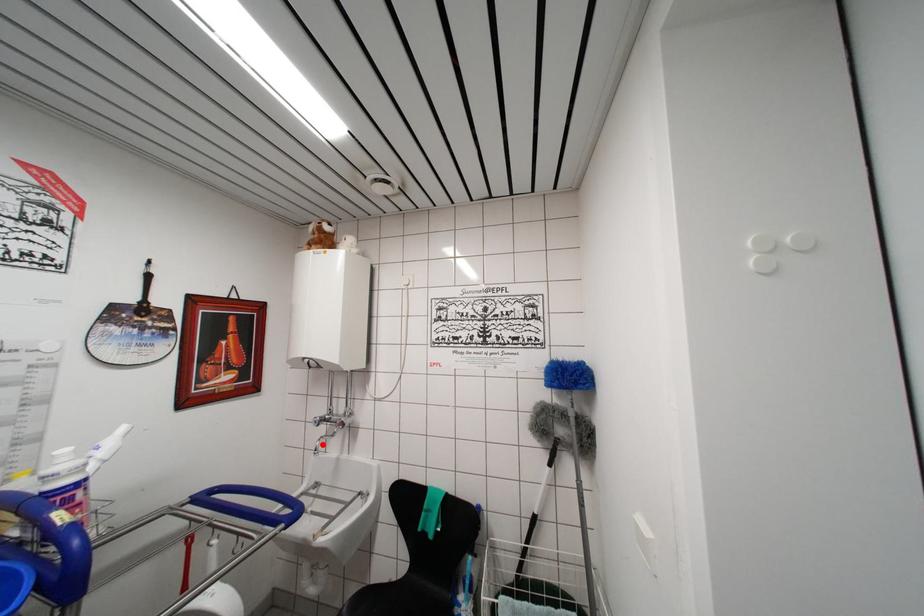
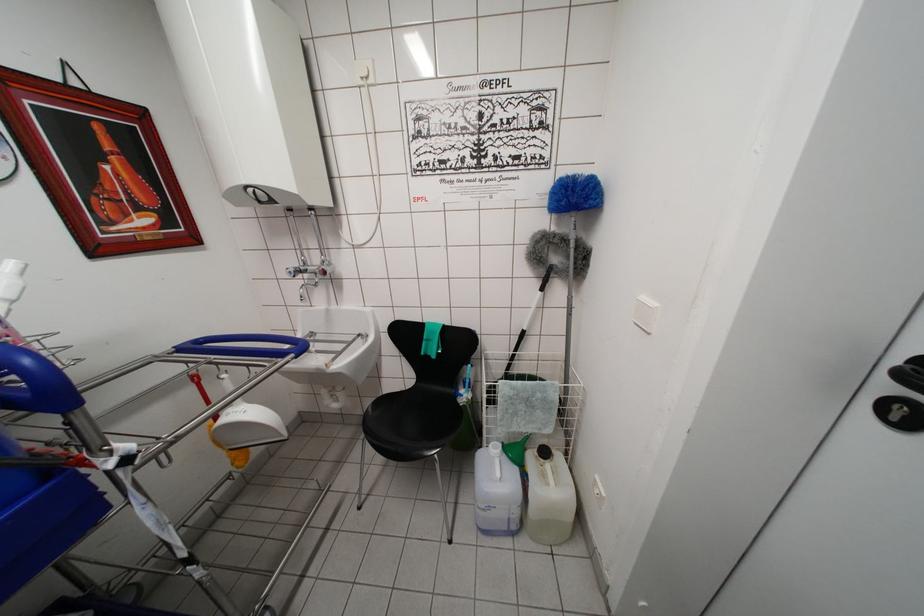
Find the pixel in the second image that matches the highlighted location in the first image.

(305, 292)